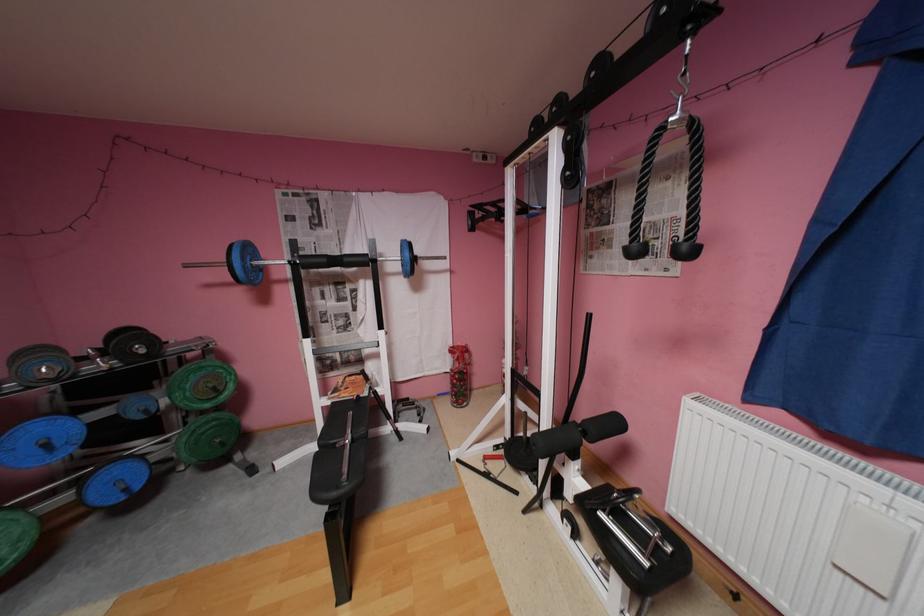
Describe the element at coordinates (695, 177) in the screenshot. I see `the black padded roller` at that location.